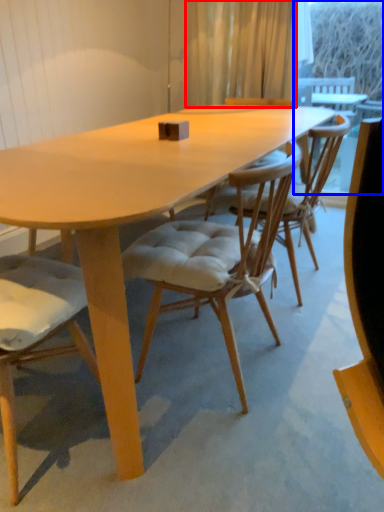
Question: Which object is further to the camera taking this photo, curtain (highlighted by a red box) or window screen (highlighted by a blue box)?

Choices:
 (A) curtain
 (B) window screen

Answer: (B)